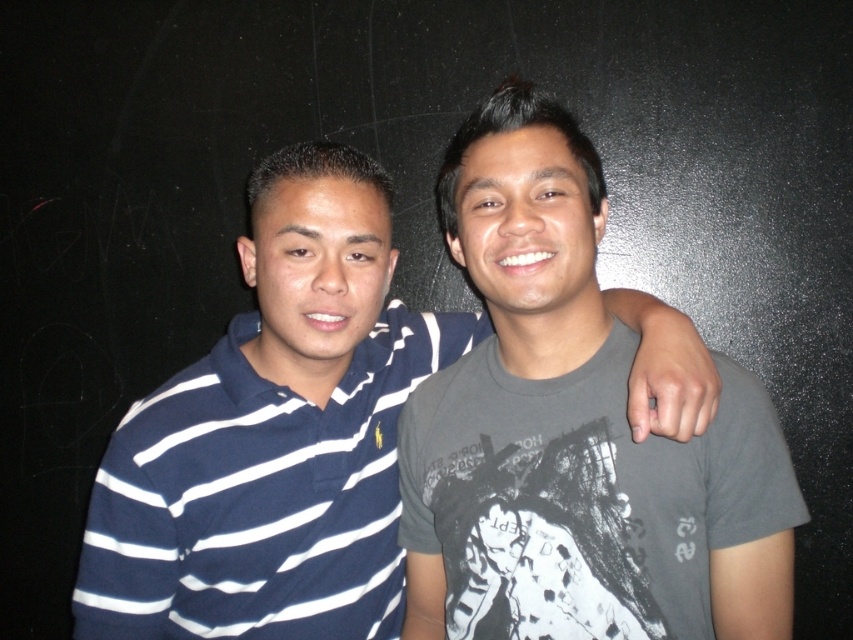
Question: Which object appears closest to the camera in this image?

Choices:
 (A) gray matte t-shirt at center
 (B) blue striped polo shirt at left

Answer: (A)

Question: Does gray matte t-shirt at center have a lesser width compared to blue striped polo shirt at left?

Choices:
 (A) yes
 (B) no

Answer: (A)

Question: Among these points, which one is farthest from the camera?

Choices:
 (A) (693, 545)
 (B) (270, 234)

Answer: (B)

Question: Is gray matte t-shirt at center to the left of blue striped polo shirt at left from the viewer's perspective?

Choices:
 (A) no
 (B) yes

Answer: (A)

Question: Is gray matte t-shirt at center to the left of blue striped polo shirt at left from the viewer's perspective?

Choices:
 (A) no
 (B) yes

Answer: (A)